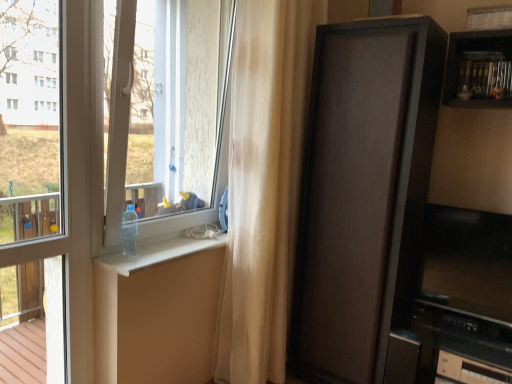
Identify the location of matte brown cabinet at right. (362, 194).

I want to click on transparent plastic window screen at left, so click(167, 108).

Where is `clear plastic bottle at lower center`? clear plastic bottle at lower center is located at coordinates (162, 251).

Are matte brown cabinet at right and clear plastic bottle at lower center far apart?

That's not correct — matte brown cabinet at right is a little close to clear plastic bottle at lower center.

Is matte brown cabinet at right taller or shorter than clear plastic bottle at lower center?

matte brown cabinet at right is taller than clear plastic bottle at lower center.

From the picture: Is matte brown cabinet at right inside or outside of clear plastic bottle at lower center?

matte brown cabinet at right cannot be found inside clear plastic bottle at lower center.

Considering the positions of objects matte brown cabinet at right and clear plastic bottle at lower center in the image provided, who is more to the left, matte brown cabinet at right or clear plastic bottle at lower center?

clear plastic bottle at lower center is more to the left.

Looking at this image, from the image's perspective, is sheer beige curtain at center above or below clear glass window at left?

Clearly, from the image's perspective, sheer beige curtain at center is above clear glass window at left.

Is sheer beige curtain at center positioned behind clear glass window at left?

Yes, sheer beige curtain at center is further from the viewer.

Does point (262, 8) come in front of point (61, 129)?

No, (262, 8) is behind (61, 129).

Considering the sizes of objects sheer beige curtain at center and matte brown cabinet at right in the image provided, who is thinner, sheer beige curtain at center or matte brown cabinet at right?

sheer beige curtain at center.

From a real-world perspective, between sheer beige curtain at center and matte brown cabinet at right, who is vertically higher?

From a 3D spatial view, sheer beige curtain at center is above.

Which of these two, sheer beige curtain at center or matte brown cabinet at right, is bigger?

Bigger between the two is matte brown cabinet at right.

At what (x,y) coordinates should I click in order to perform the action: click on curtain that is on the left side of matte brown cabinet at right. Please return your answer as a coordinate pair (x, y). This screenshot has width=512, height=384. Looking at the image, I should click on (263, 184).

Considering the relative sizes of matte brown cabinet at right and transparent plastic window screen at left in the image provided, is matte brown cabinet at right bigger than transparent plastic window screen at left?

Correct, matte brown cabinet at right is larger in size than transparent plastic window screen at left.

Is matte brown cabinet at right far away from transparent plastic window screen at left?

They are positioned close to each other.

From the image's perspective, which one is positioned higher, matte brown cabinet at right or transparent plastic window screen at left?

From the image's view, transparent plastic window screen at left is above.

Where is `screen door below the transparent plastic window screen at left (from a real-world perspective)`? This screenshot has width=512, height=384. screen door below the transparent plastic window screen at left (from a real-world perspective) is located at coordinates (362, 194).

Considering the relative positions of sheer beige curtain at center and clear plastic bottle at lower center in the image provided, is sheer beige curtain at center to the left or to the right of clear plastic bottle at lower center?

sheer beige curtain at center is to the right of clear plastic bottle at lower center.

Which is less distant, [223,285] or [114,270]?

Clearly, point [223,285] is more distant from the camera than point [114,270].

Is sheer beige curtain at center looking in the opposite direction of clear plastic bottle at lower center?

sheer beige curtain at center is not turned away from clear plastic bottle at lower center.

You are a GUI agent. You are given a task and a screenshot of the screen. Output one action in this format:
    pyautogui.click(x=<x>, y=<y>)
    Task: Click on the curtain lying on the right of clear plastic bottle at lower center
    The height and width of the screenshot is (384, 512).
    Given the screenshot: What is the action you would take?
    pyautogui.click(x=263, y=184)

Is black plastic drawer at lower right inside clear plastic bottle at lower center?

No, black plastic drawer at lower right is not surrounded by clear plastic bottle at lower center.

This screenshot has width=512, height=384. In order to click on window sill on the left of black plastic drawer at lower right in this screenshot , I will do `click(162, 251)`.

Who is shorter, clear plastic bottle at lower center or black plastic drawer at lower right?

Standing shorter between the two is clear plastic bottle at lower center.

Does clear plastic bottle at lower center have a larger size compared to black plastic drawer at lower right?

Actually, clear plastic bottle at lower center might be smaller than black plastic drawer at lower right.

Can you confirm if clear plastic bottle at lower center is wider than matte brown cabinet at right?

No, clear plastic bottle at lower center is not wider than matte brown cabinet at right.

The width and height of the screenshot is (512, 384). What are the coordinates of `window sill below the matte brown cabinet at right (from a real-world perspective)` in the screenshot? It's located at (162, 251).

Based on the photo, from the image's perspective, is clear plastic bottle at lower center positioned above or below matte brown cabinet at right?

clear plastic bottle at lower center is below matte brown cabinet at right.

Locate an element on the screen. screen door lying behind the clear plastic bottle at lower center is located at coordinates (362, 194).

I want to click on window frame on the left of sheer beige curtain at center, so click(31, 123).

Based on their spatial positions, is clear plastic bottle at lower center or black plastic drawer at lower right closer to transparent plastic window screen at left?

The object closer to transparent plastic window screen at left is clear plastic bottle at lower center.

Consider the image. When comparing their distances from clear glass window at left, does sheer beige curtain at center or clear plastic bottle at lower center seem further?

sheer beige curtain at center.

Consider the image. Which object lies further to the anchor point black plastic drawer at lower right, transparent plastic window screen at left or matte brown cabinet at right?

transparent plastic window screen at left is further to black plastic drawer at lower right.

From the image, which object appears to be nearer to transparent plastic window screen at left, clear glass window at left or matte brown cabinet at right?

Among the two, clear glass window at left is located nearer to transparent plastic window screen at left.

Which object lies nearer to the anchor point black plastic drawer at lower right, transparent plastic window screen at left or clear plastic bottle at lower center?

Based on the image, clear plastic bottle at lower center appears to be nearer to black plastic drawer at lower right.

Which object lies further to the anchor point black plastic drawer at lower right, clear plastic bottle at lower center or sheer beige curtain at center?

clear plastic bottle at lower center is further to black plastic drawer at lower right.

Estimate the real-world distances between objects in this image. Which object is further from black plastic drawer at lower right, clear glass window at left or clear plastic bottle at lower center?

Based on the image, clear glass window at left appears to be further to black plastic drawer at lower right.

Estimate the real-world distances between objects in this image. Which object is closer to transparent plastic window screen at left, clear plastic bottle at lower center or clear glass window at left?

The object closer to transparent plastic window screen at left is clear plastic bottle at lower center.

This screenshot has height=384, width=512. I want to click on curtain between clear plastic bottle at lower center and black plastic drawer at lower right in the horizontal direction, so click(x=263, y=184).

In order to click on window sill between clear glass window at left and matte brown cabinet at right in this screenshot , I will do `click(162, 251)`.

Where is `screen door located between sheer beige curtain at center and black plastic drawer at lower right in the left-right direction`? The image size is (512, 384). screen door located between sheer beige curtain at center and black plastic drawer at lower right in the left-right direction is located at coordinates (x=362, y=194).

Image resolution: width=512 pixels, height=384 pixels. I want to click on curtain between clear plastic bottle at lower center and matte brown cabinet at right, so click(263, 184).